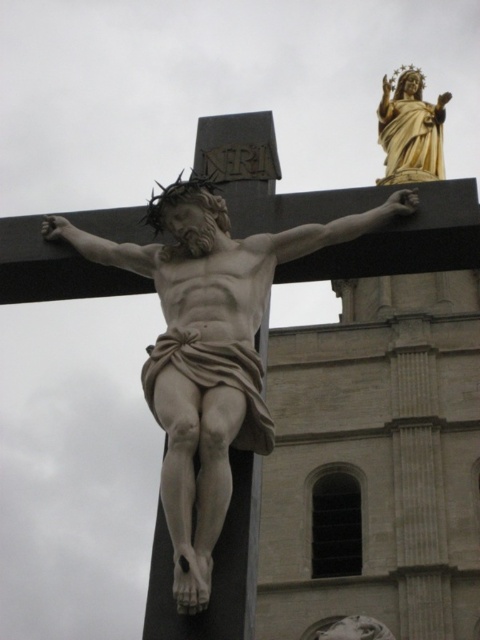
Question: Can you confirm if white marble statue at center is positioned to the right of smooth white statue at center?

Choices:
 (A) yes
 (B) no

Answer: (B)

Question: Which of these objects is positioned closest to the white marble statue at center?

Choices:
 (A) smooth white statue at center
 (B) gold polished statue at upper right

Answer: (A)

Question: Which object is positioned farthest from the gold polished statue at upper right?

Choices:
 (A) white marble statue at center
 (B) smooth white statue at center

Answer: (A)

Question: Is gold polished statue at upper right bigger than smooth white statue at center?

Choices:
 (A) yes
 (B) no

Answer: (A)

Question: Which of the following is the farthest from the observer?

Choices:
 (A) white marble statue at center
 (B) gold polished statue at upper right
 (C) smooth white statue at center

Answer: (B)

Question: Does gold polished statue at upper right have a larger size compared to smooth white statue at center?

Choices:
 (A) no
 (B) yes

Answer: (B)